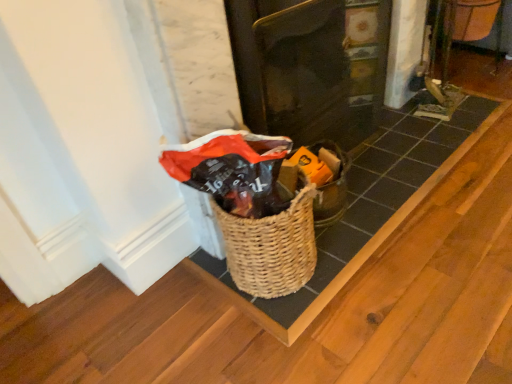
Question: From the image's perspective, is woven brown basket at center beneath matte black door at center?

Choices:
 (A) no
 (B) yes

Answer: (B)

Question: Is matte black door at center at the back of woven brown basket at center?

Choices:
 (A) no
 (B) yes

Answer: (A)

Question: Is woven brown basket at center in contact with matte black door at center?

Choices:
 (A) no
 (B) yes

Answer: (A)

Question: Considering the relative sizes of woven brown basket at center and matte black door at center in the image provided, is woven brown basket at center smaller than matte black door at center?

Choices:
 (A) no
 (B) yes

Answer: (B)

Question: Does woven brown basket at center come behind matte black door at center?

Choices:
 (A) no
 (B) yes

Answer: (A)

Question: From a real-world perspective, is woven brown basket at center beneath matte black door at center?

Choices:
 (A) yes
 (B) no

Answer: (A)

Question: Could you tell me if woven brown basket at center is facing woven wood basket at center?

Choices:
 (A) no
 (B) yes

Answer: (A)

Question: Is woven brown basket at center positioned before woven wood basket at center?

Choices:
 (A) no
 (B) yes

Answer: (B)

Question: Considering the relative sizes of woven brown basket at center and woven wood basket at center in the image provided, is woven brown basket at center wider than woven wood basket at center?

Choices:
 (A) no
 (B) yes

Answer: (A)

Question: From the image's perspective, does woven brown basket at center appear higher than woven wood basket at center?

Choices:
 (A) no
 (B) yes

Answer: (A)

Question: Is woven brown basket at center surrounding woven wood basket at center?

Choices:
 (A) no
 (B) yes

Answer: (A)

Question: Is woven brown basket at center at the left side of woven wood basket at center?

Choices:
 (A) no
 (B) yes

Answer: (B)

Question: From the image's perspective, is woven wood basket at center beneath matte black door at center?

Choices:
 (A) no
 (B) yes

Answer: (B)